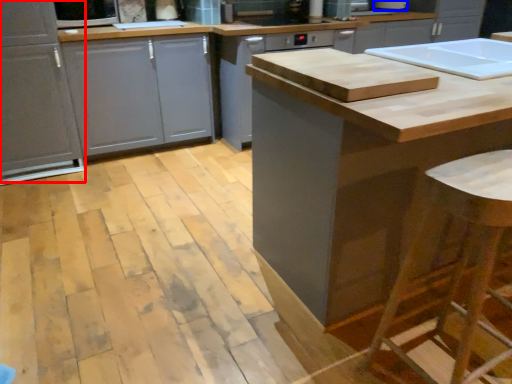
Question: Among these objects, which one is nearest to the camera, cabinetry (highlighted by a red box) or appliance (highlighted by a blue box)?

Choices:
 (A) cabinetry
 (B) appliance

Answer: (A)